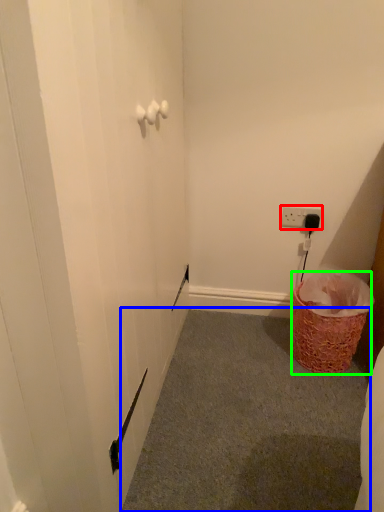
Question: Based on their relative distances, which object is nearer to electric outlet (highlighted by a red box)? Choose from plain (highlighted by a blue box) and basket (highlighted by a green box).

Choices:
 (A) plain
 (B) basket

Answer: (B)